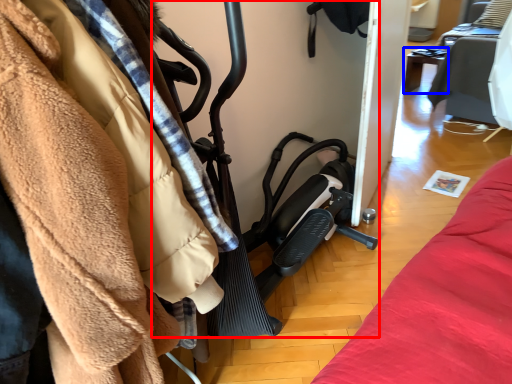
Question: Which object appears farthest to the camera in this image, baby carriage (highlighted by a red box) or furniture (highlighted by a blue box)?

Choices:
 (A) baby carriage
 (B) furniture

Answer: (B)